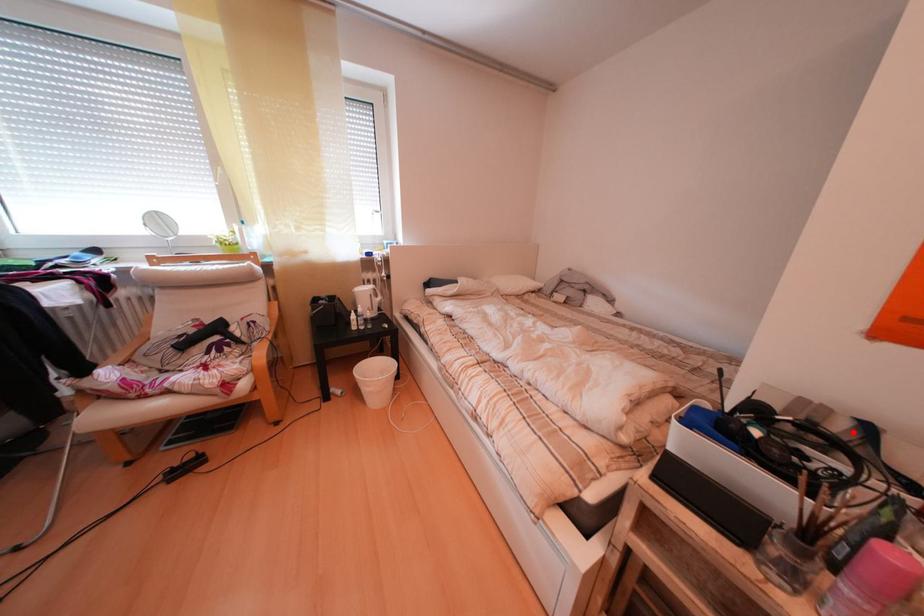
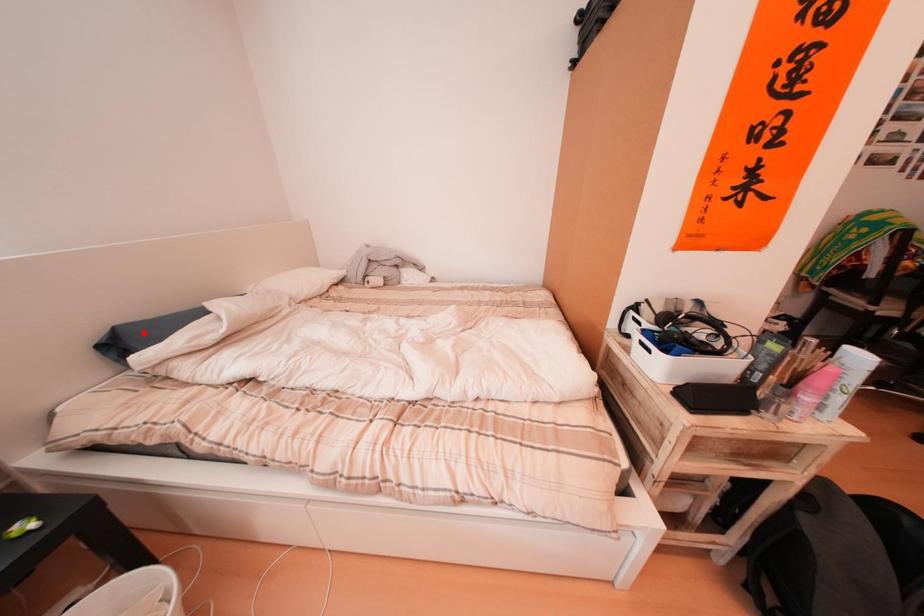
I am providing you with two images of the same scene from different viewpoints. A red point is marked on the first image and another point is marked on the second image. Is the red point in image1 aligned with the point shown in image2?

No